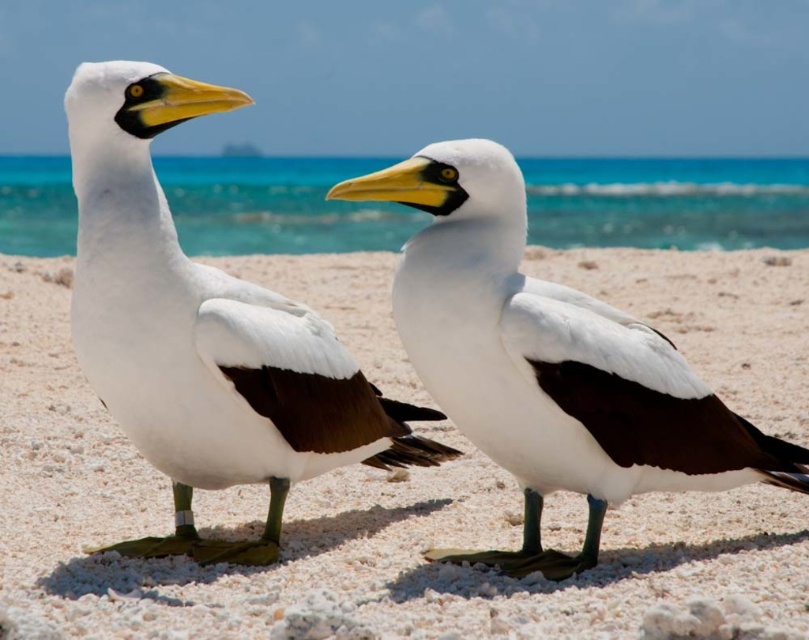
Question: Which object is farther from the camera taking this photo?

Choices:
 (A) white sandy beach at center
 (B) white matte mollymawk at center
 (C) white matte mollymawk at left

Answer: (C)

Question: Can you confirm if white sandy beach at center is positioned below white matte mollymawk at left?

Choices:
 (A) yes
 (B) no

Answer: (B)

Question: Which of the following is the closest to the observer?

Choices:
 (A) white sandy beach at center
 (B) white matte mollymawk at center

Answer: (A)

Question: Can you confirm if white sandy beach at center is positioned below white matte mollymawk at left?

Choices:
 (A) no
 (B) yes

Answer: (A)

Question: Does white matte mollymawk at left appear under white matte mollymawk at center?

Choices:
 (A) no
 (B) yes

Answer: (A)

Question: Which point is closer to the camera?

Choices:
 (A) (519, 448)
 (B) (282, 305)
 (C) (219, 580)

Answer: (A)